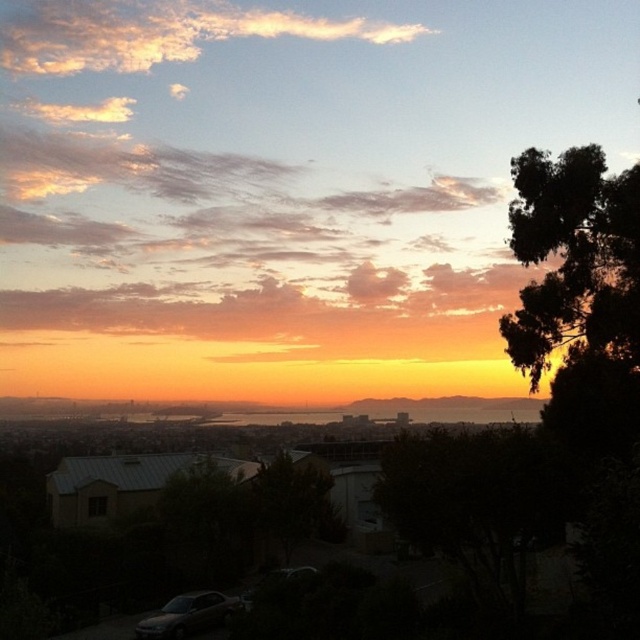
You are standing at the point labeled point [291,506] and want to walk towards the green leafy tree at center. Which direction should you go?

The point labeled point [291,506] is the location of the green leafy tree at center, so you are already at the tree.

Consider the image. You are standing on the hilltop where the image was taken. You see the green leafy tree at center and the matte silver car at lower left. Which object would block your view of the cityscape if you move closer to it?

The green leafy tree at center is much taller than the matte silver car at lower left, so it would block your view of the cityscape if you move closer to it.

You are a photographer standing at the hilltop overlooking the city. You want to capture a photo that includes both the green leafy tree at center and the matte silver car at lower left. Which object will appear bigger in your photo?

The green leafy tree at center will appear bigger in the photo because it has a larger size compared to the matte silver car at lower left.